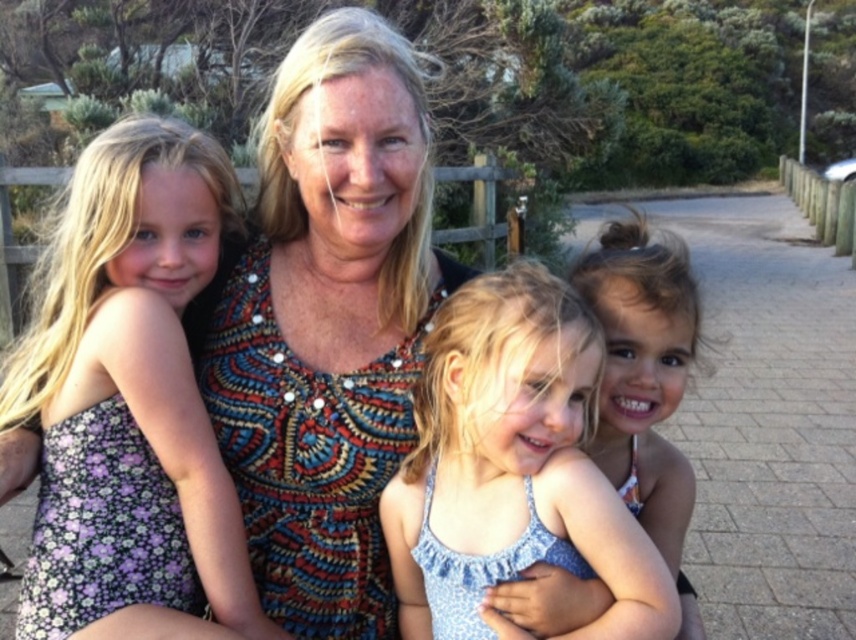
You are a photographer trying to capture a group photo of the family. You notice the multicolored beaded dress at center and the purple floral dress at left. Which dress should you position closer to the camera to ensure both are visible in the frame?

The purple floral dress at left should be positioned closer to the camera because the multicolored beaded dress at center is already to the right of it, so moving the left one forward would keep both in view.

You are a photographer who wants to capture a group photo of the purple floral dress at left and the blue fabric dress at center. Which dress should you focus on first to ensure it fits well in the frame?

The purple floral dress at left is larger in size compared to the blue fabric dress at center, so you should focus on positioning the purple floral dress at left first to ensure it fits well within the frame.